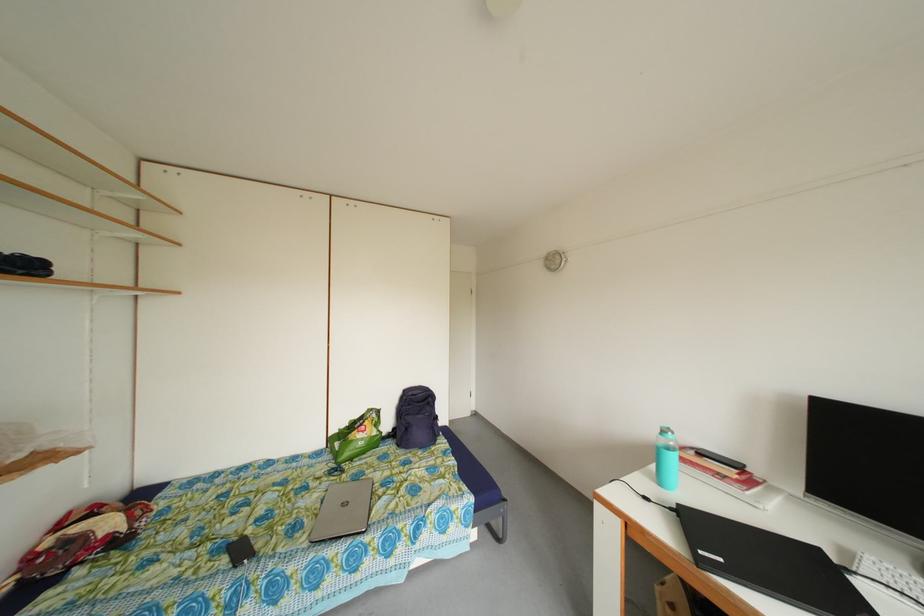
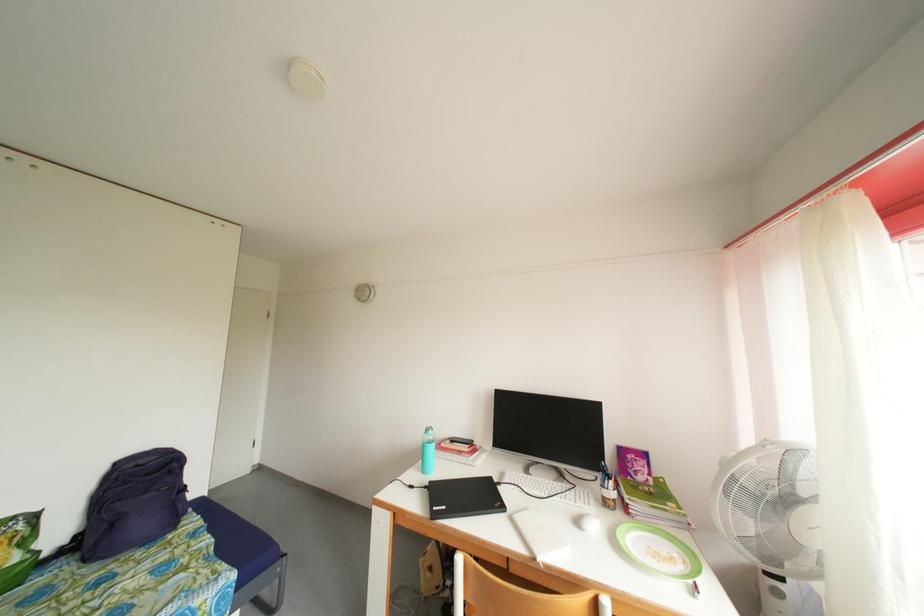
In the second image, find the point that corresponds to pixel 671 438 in the first image.

(434, 436)